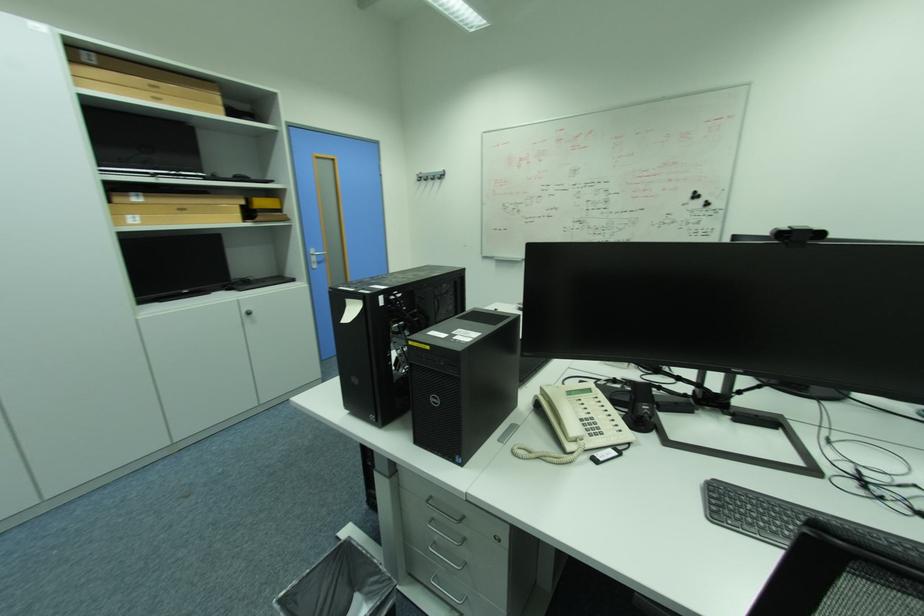
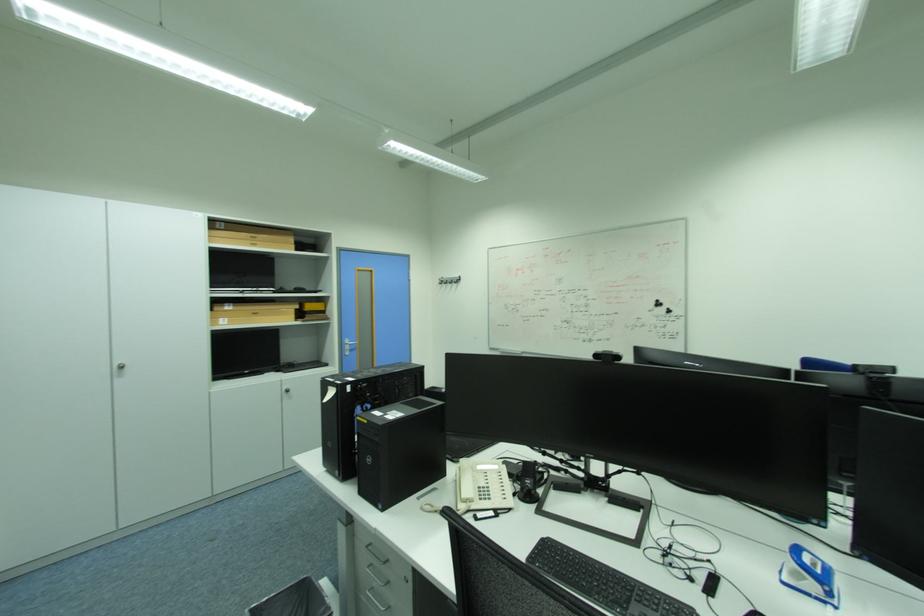
Find the pixel in the second image that matches [136,217] in the first image.

(228, 320)